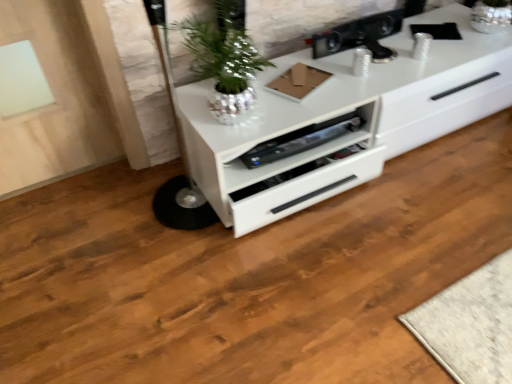
You are a GUI agent. You are given a task and a screenshot of the screen. Output one action in this format:
    pyautogui.click(x=<x>, y=<y>)
    Task: Click on the vacant space underneath shiny metallic plant at center (from a real-world perspective)
    This screenshot has height=384, width=512.
    Given the screenshot: What is the action you would take?
    pyautogui.click(x=242, y=121)